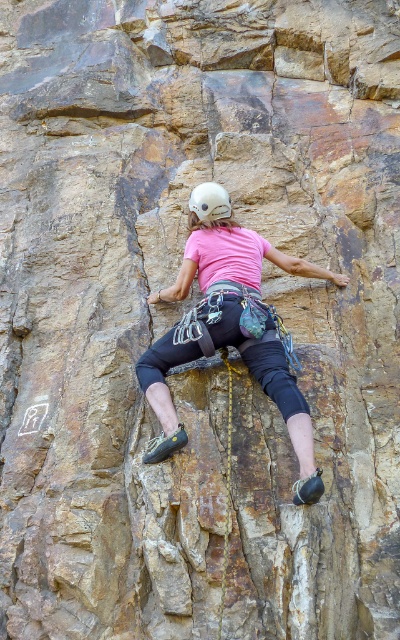
You are a photographer wanting to capture the climber in the scene. Since the pink fabric shirt at center and the white matte helmet at center are both at the center, which one appears wider in the photo?

The pink fabric shirt at center appears wider than the white matte helmet at center because its width surpasses the helmet.

You are a photographer trying to capture the climber. You notice the pink fabric shirt at center and the white matte helmet at center. Which object should you focus on first if you want to ensure both are in focus without adjusting the camera focus?

The pink fabric shirt at center is closer to the viewer than the white matte helmet at center. To keep both in focus, you should focus on the pink fabric shirt at center first since it is closer, and the depth of field will naturally include the helmet behind it.